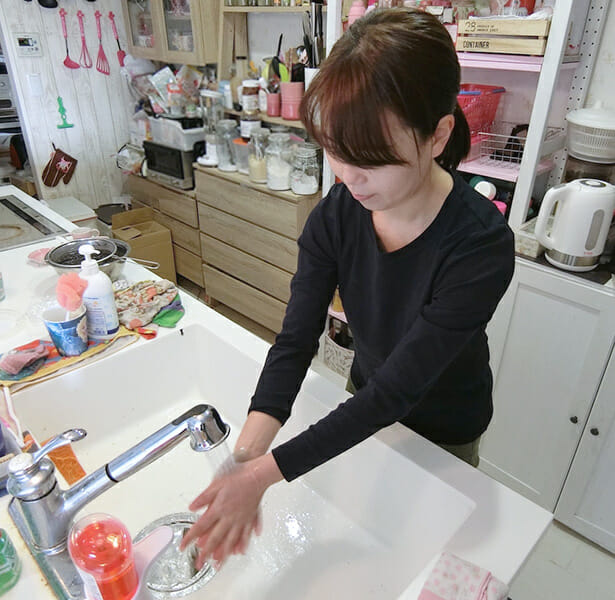
This screenshot has width=615, height=600. Identify the location of sink. (331, 557).